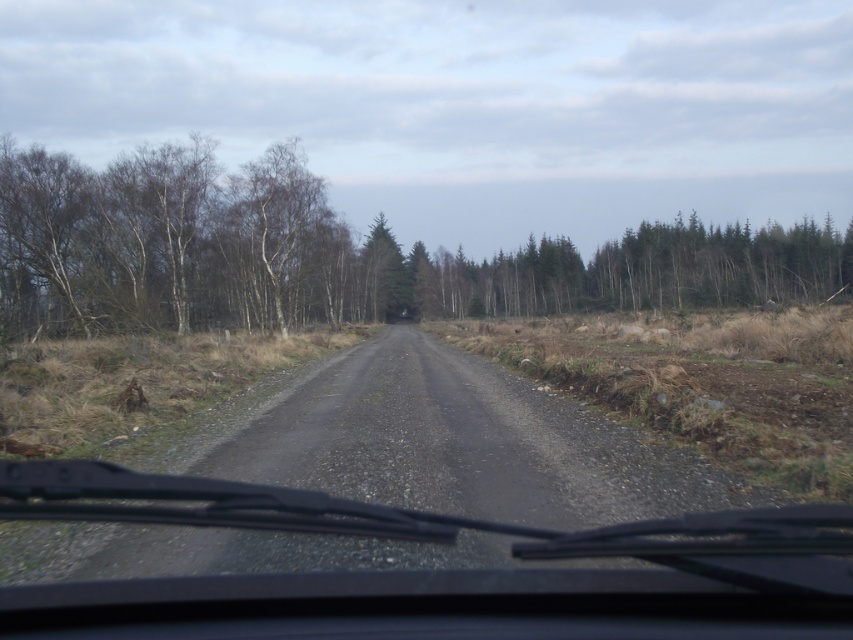
Does bare branches at left appear over green matte trees at center?

No, bare branches at left is not above green matte trees at center.

Can you confirm if bare branches at left is taller than green matte trees at center?

Indeed, bare branches at left has a greater height compared to green matte trees at center.

The image size is (853, 640). What do you see at coordinates (169, 243) in the screenshot?
I see `bare branches at left` at bounding box center [169, 243].

Locate an element on the screen. The image size is (853, 640). bare branches at left is located at coordinates (169, 243).

Identify the location of bare branches at left. The height and width of the screenshot is (640, 853). (169, 243).

Who is more distant from viewer, (329, 310) or (370, 256)?

Positioned behind is point (370, 256).

Is point (331, 253) farther from viewer compared to point (378, 248)?

No, it is in front of (378, 248).

Where is `bare branches at left`? This screenshot has width=853, height=640. bare branches at left is located at coordinates (169, 243).

Can you confirm if green matte trees at center is positioned above green matte tree at center?

Yes.

Does green matte trees at center appear under green matte tree at center?

Actually, green matte trees at center is above green matte tree at center.

Which is in front, point (705, 257) or point (399, 266)?

Positioned in front is point (705, 257).

At what (x,y) coordinates should I click in order to perform the action: click on green matte trees at center. Please return your answer as a coordinate pair (x, y). Looking at the image, I should click on (639, 272).